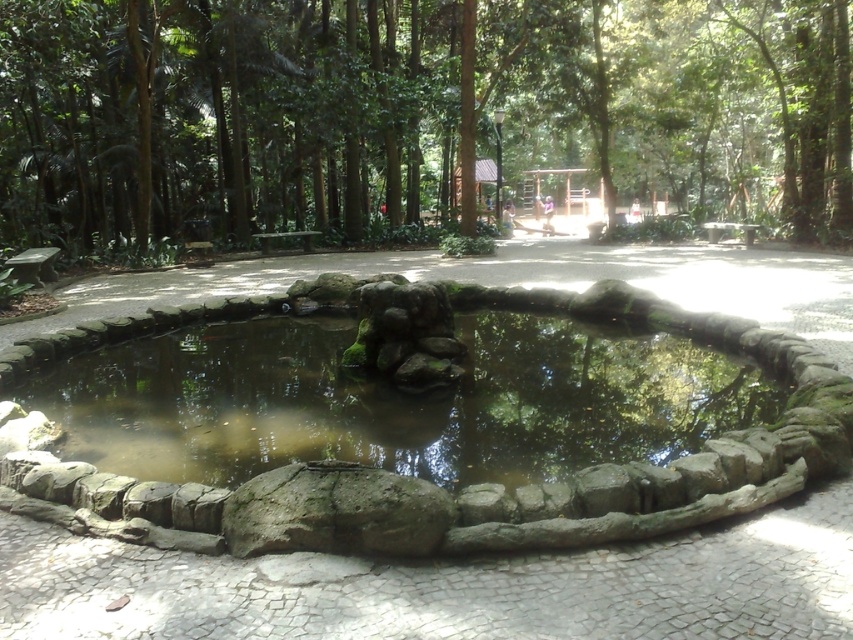
The height and width of the screenshot is (640, 853). Identify the location of green leafy tree at center. (408, 108).